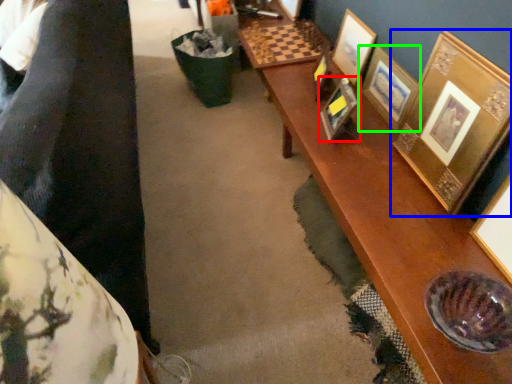
Question: Considering the real-world distances, which object is closest to picture frame (highlighted by a red box)? picture frame (highlighted by a blue box) or picture frame (highlighted by a green box).

Choices:
 (A) picture frame
 (B) picture frame

Answer: (B)